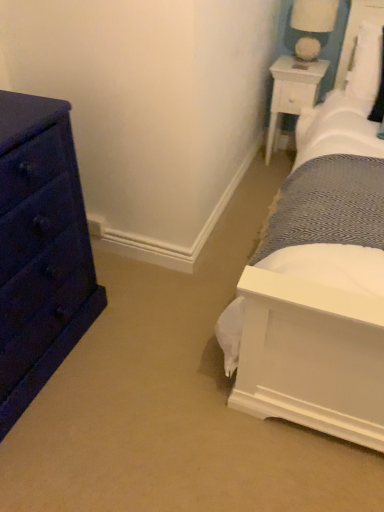
You are a GUI agent. You are given a task and a screenshot of the screen. Output one action in this format:
    pyautogui.click(x=<x>, y=<y>)
    Task: Click on the vacant space situated above white wood nightstand at upper right (from a real-world perspective)
    This screenshot has width=384, height=512.
    Given the screenshot: What is the action you would take?
    pyautogui.click(x=302, y=65)